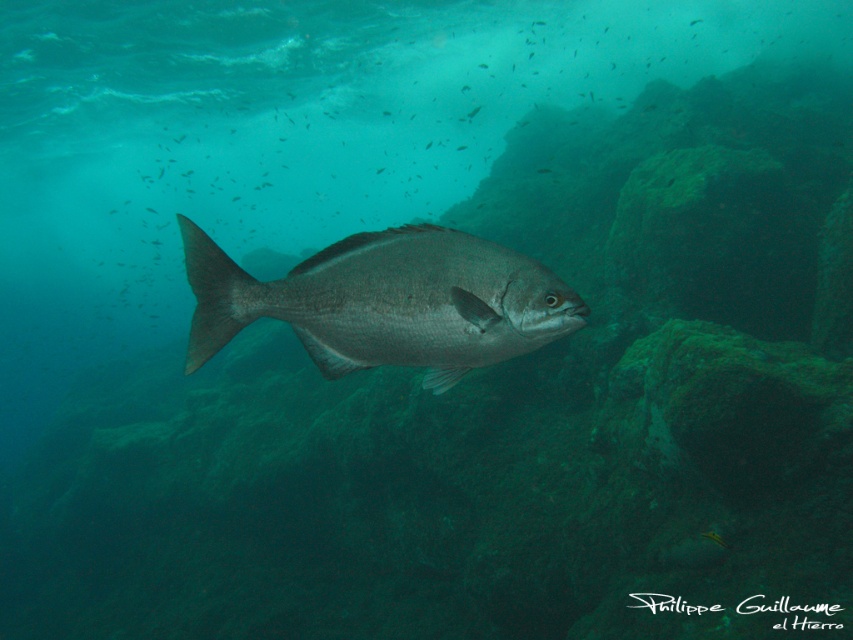
Question: Can you confirm if silvery metallic fish at center is positioned to the right of smooth rock at center?

Choices:
 (A) yes
 (B) no

Answer: (B)

Question: Which of the following is the farthest from the observer?

Choices:
 (A) smooth rock at center
 (B) silvery metallic fish at center

Answer: (A)

Question: Is silvery metallic fish at center thinner than smooth rock at center?

Choices:
 (A) no
 (B) yes

Answer: (B)

Question: Does silvery metallic fish at center appear on the left side of smooth rock at center?

Choices:
 (A) no
 (B) yes

Answer: (B)

Question: Which point is farther from the camera taking this photo?

Choices:
 (A) (733, 196)
 (B) (393, 276)

Answer: (A)